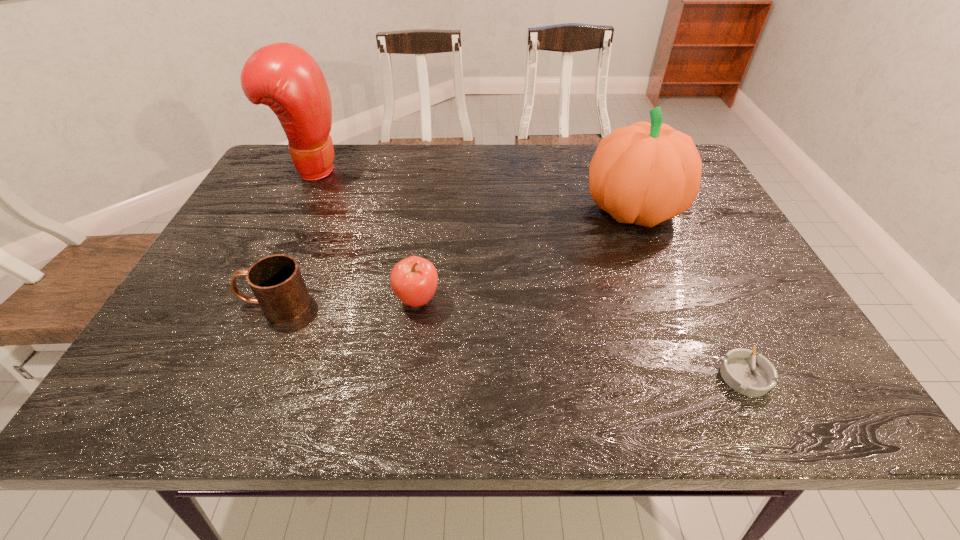
This screenshot has width=960, height=540. Find the location of `vacant space positioned 0.360m on the back of the nearest object`. vacant space positioned 0.360m on the back of the nearest object is located at coordinates (676, 235).

Identify the location of boxing glove that is at the far edge. (283, 76).

At what (x,y) coordinates should I click in order to perform the action: click on pumpkin that is at the far edge. Please return your answer as a coordinate pair (x, y). Image resolution: width=960 pixels, height=540 pixels. Looking at the image, I should click on (646, 173).

Where is `object at the near edge`? The image size is (960, 540). object at the near edge is located at coordinates (754, 376).

Where is `boxing glove situated at the left edge`? This screenshot has width=960, height=540. boxing glove situated at the left edge is located at coordinates (283, 76).

The width and height of the screenshot is (960, 540). I want to click on mug that is at the left edge, so click(x=276, y=281).

Locate an element on the screen. The height and width of the screenshot is (540, 960). pumpkin at the right edge is located at coordinates (646, 173).

The width and height of the screenshot is (960, 540). Find the location of `ashtray located at the right edge`. ashtray located at the right edge is located at coordinates (754, 376).

Where is `object present at the far left corner`? object present at the far left corner is located at coordinates (283, 76).

In order to click on object at the far right corner in this screenshot , I will do `click(646, 173)`.